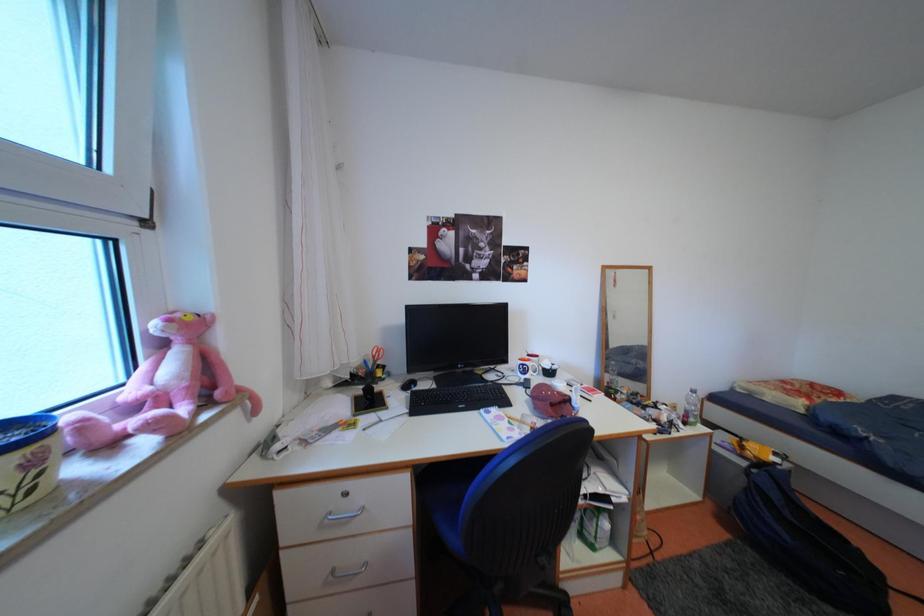
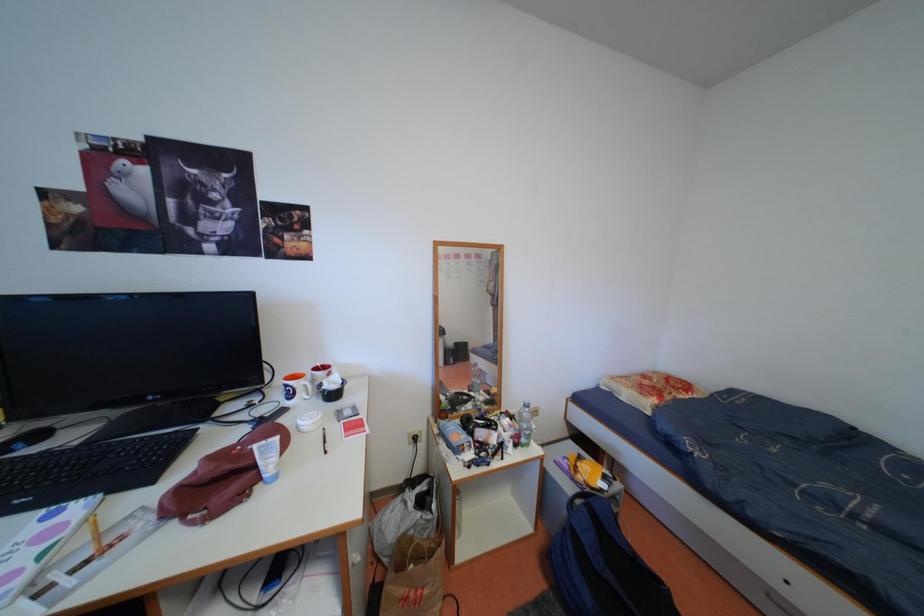
In a continuous first-person perspective shot, in which direction is the camera moving?

The movement direction of the cameraman is right, forward.